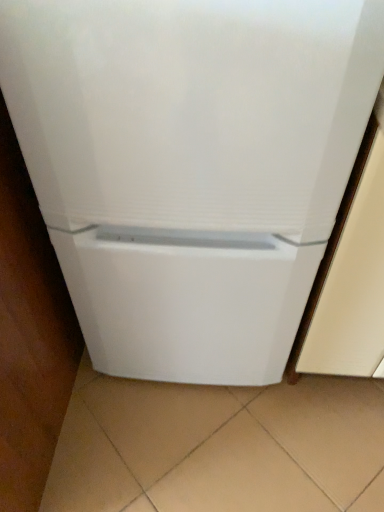
This screenshot has height=512, width=384. What are the coordinates of `white matte cabinet at left` in the screenshot? It's located at (30, 335).

Describe the element at coordinates (30, 335) in the screenshot. The width and height of the screenshot is (384, 512). I see `white matte cabinet at left` at that location.

At what (x,y) coordinates should I click in order to perform the action: click on white matte cabinet at left. Please return your answer as a coordinate pair (x, y). Looking at the image, I should click on (30, 335).